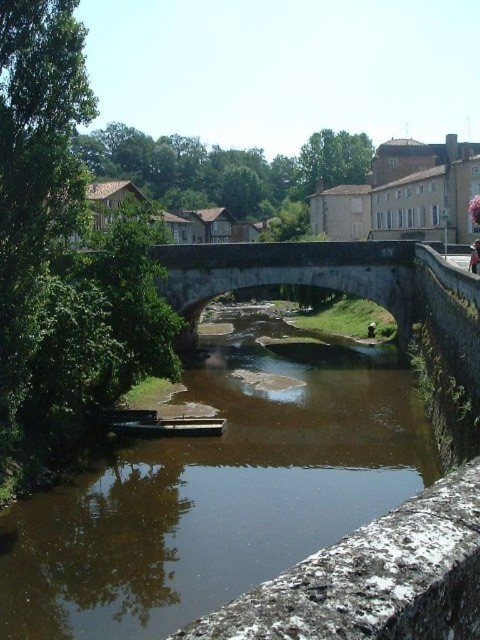
You are standing at the edge of the scene and want to cross the river. The brown stone river at center is in your way. Which direction should you move to reach the river?

The brown stone river at center is located at point 0.777 on the x axis and 0.446 on the y axis. Since you are at the edge, you should move towards the center to reach the river.

You are standing at the camera position and want to cross the river to the other side. The brown stone river at center is in your way. If you walk straight ahead, will you be able to reach the other side without crossing the river?

The brown stone river at center is 51.29 feet away from the camera. Since you are walking straight ahead towards the river, you will eventually reach the other side after crossing the river, so you cannot reach the other side without crossing the river.

You are standing on the stone bridge and looking down at the river. You see the brown stone river at center and the light pink fabric at center. Which object is positioned to the left?

The brown stone river at center is to the left of the light pink fabric at center.